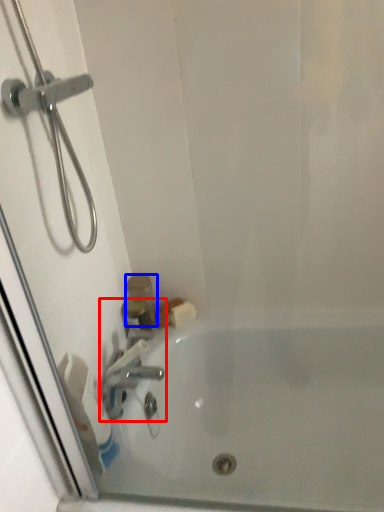
Question: Which point is further to the camera, tap (highlighted by a red box) or toiletry (highlighted by a blue box)?

Choices:
 (A) tap
 (B) toiletry

Answer: (B)